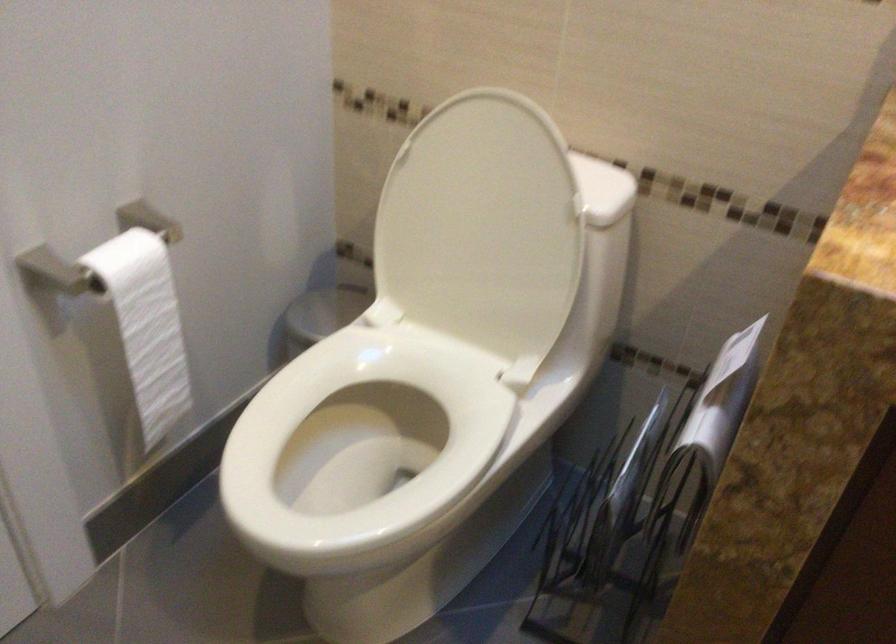
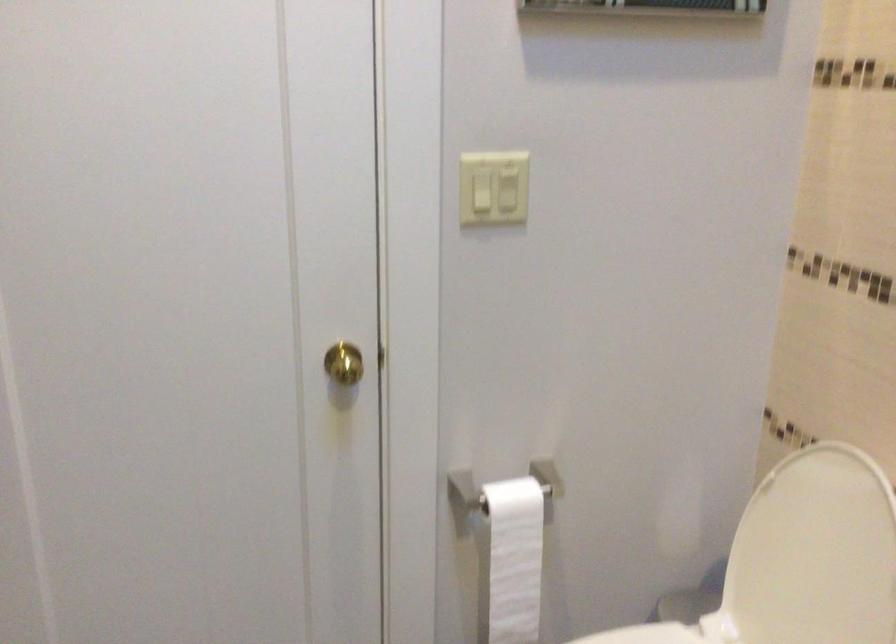
Where in the second image is the point corresponding to point 325,353 from the first image?

(645, 635)